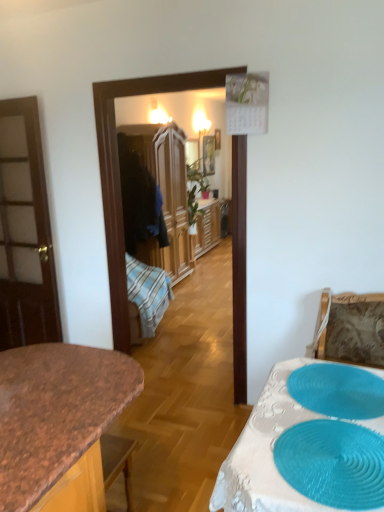
Locate an element on the screen. This screenshot has height=512, width=384. vacant area on top of teal rubber placemat at lower right, arranged as the 2th oval when viewed from the back (from a real-world perspective) is located at coordinates (337, 452).